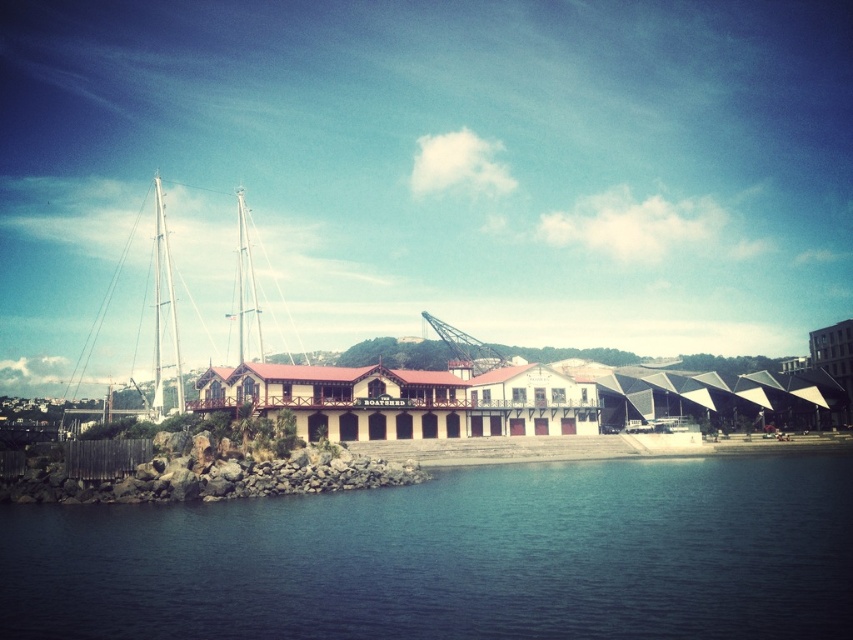
Question: Can you confirm if white glossy sailboat at left is bigger than white matte mast at left?

Choices:
 (A) no
 (B) yes

Answer: (B)

Question: Which of the following is the farthest from the observer?

Choices:
 (A) white glossy sailboat at left
 (B) white matte mast at left

Answer: (B)

Question: Which object is farther from the camera taking this photo?

Choices:
 (A) white glossy sailboat at left
 (B) blue water at lower left
 (C) white matte mast at left

Answer: (C)

Question: Is blue water at lower left below white glossy sailboat at left?

Choices:
 (A) yes
 (B) no

Answer: (A)

Question: Which object is closer to the camera taking this photo?

Choices:
 (A) white matte mast at left
 (B) white glossy sailboat at left
 (C) blue water at lower left

Answer: (C)

Question: Does white glossy sailboat at left have a greater width compared to white matte mast at left?

Choices:
 (A) yes
 (B) no

Answer: (A)